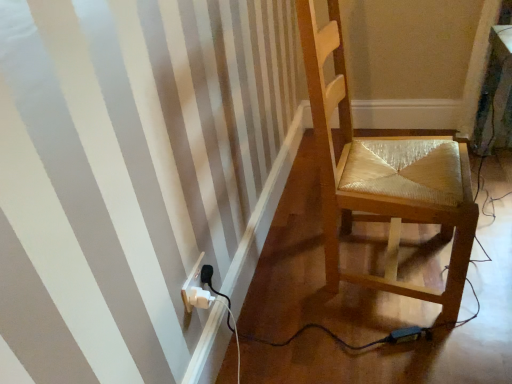
This screenshot has height=384, width=512. What do you see at coordinates (384, 176) in the screenshot?
I see `wooden chair at right` at bounding box center [384, 176].

Where is `wooden chair at right`? This screenshot has width=512, height=384. wooden chair at right is located at coordinates (384, 176).

What do you see at coordinates (195, 290) in the screenshot? I see `white plastic electrical outlet at lower left` at bounding box center [195, 290].

You are a GUI agent. You are given a task and a screenshot of the screen. Output one action in this format:
    pyautogui.click(x=<x>, y=<y>)
    Task: Click on the white plastic electrical outlet at lower left
    
    Given the screenshot: What is the action you would take?
    pyautogui.click(x=195, y=290)

Locate an element on the screen. Image resolution: width=512 pixels, height=384 pixels. wooden chair at right is located at coordinates (384, 176).

Visually, is wooden chair at right positioned to the left or to the right of white plastic electrical outlet at lower left?

Clearly, wooden chair at right is on the right of white plastic electrical outlet at lower left in the image.

Considering the relative positions of wooden chair at right and white plastic electrical outlet at lower left in the image provided, is wooden chair at right behind white plastic electrical outlet at lower left?

No.

Does point (347, 99) lie in front of point (200, 257)?

No.

In the scene shown: From the image's perspective, relative to white plastic electrical outlet at lower left, is wooden chair at right above or below?

Based on their image positions, wooden chair at right is located above white plastic electrical outlet at lower left.

From a real-world perspective, is wooden chair at right on top of white plastic electrical outlet at lower left?

Yes, from a real-world perspective, wooden chair at right is over white plastic electrical outlet at lower left

Can you confirm if wooden chair at right is wider than white plastic electrical outlet at lower left?

Indeed, wooden chair at right has a greater width compared to white plastic electrical outlet at lower left.

Consider the image. Can you confirm if wooden chair at right is shorter than white plastic electrical outlet at lower left?

Incorrect, the height of wooden chair at right does not fall short of that of white plastic electrical outlet at lower left.

Which of these two, wooden chair at right or white plastic electrical outlet at lower left, is bigger?

wooden chair at right.

Is wooden chair at right located outside white plastic electrical outlet at lower left?

Absolutely, wooden chair at right is external to white plastic electrical outlet at lower left.

Would you say wooden chair at right is a long distance from white plastic electrical outlet at lower left?

No, there isn't a large distance between wooden chair at right and white plastic electrical outlet at lower left.

Does wooden chair at right turn towards white plastic electrical outlet at lower left?

No, wooden chair at right does not turn towards white plastic electrical outlet at lower left.

Can you tell me how much wooden chair at right and white plastic electrical outlet at lower left differ in facing direction?

5.21 degrees separate the facing orientations of wooden chair at right and white plastic electrical outlet at lower left.

The width and height of the screenshot is (512, 384). Find the location of `chair that is on the right side of white plastic electrical outlet at lower left`. chair that is on the right side of white plastic electrical outlet at lower left is located at coordinates (384, 176).

Is white plastic electrical outlet at lower left at the right side of wooden chair at right?

No, white plastic electrical outlet at lower left is not to the right of wooden chair at right.

Consider the image. Considering the relative positions of white plastic electrical outlet at lower left and wooden chair at right in the image provided, is white plastic electrical outlet at lower left behind wooden chair at right?

Yes, it is.

Does point (188, 292) come in front of point (326, 249)?

Yes, it is in front of point (326, 249).

From the image's perspective, which object appears higher, white plastic electrical outlet at lower left or wooden chair at right?

wooden chair at right, from the image's perspective.

From a real-world perspective, is white plastic electrical outlet at lower left on top of wooden chair at right?

No, from a real-world perspective, white plastic electrical outlet at lower left is not over wooden chair at right

Which of these two, white plastic electrical outlet at lower left or wooden chair at right, is wider?

wooden chair at right is wider.

Is white plastic electrical outlet at lower left taller or shorter than wooden chair at right?

Considering their sizes, white plastic electrical outlet at lower left has less height than wooden chair at right.

In terms of size, does white plastic electrical outlet at lower left appear bigger or smaller than wooden chair at right?

Considering their sizes, white plastic electrical outlet at lower left takes up less space than wooden chair at right.

Is white plastic electrical outlet at lower left inside the boundaries of wooden chair at right, or outside?

white plastic electrical outlet at lower left is not inside wooden chair at right, it's outside.

Are white plastic electrical outlet at lower left and wooden chair at right far apart?

No, white plastic electrical outlet at lower left is not far from wooden chair at right.

Is white plastic electrical outlet at lower left oriented towards wooden chair at right?

No, white plastic electrical outlet at lower left does not turn towards wooden chair at right.

What's the angular difference between white plastic electrical outlet at lower left and wooden chair at right's facing directions?

The facing directions of white plastic electrical outlet at lower left and wooden chair at right are 5.21 degrees apart.

Measure the distance between white plastic electrical outlet at lower left and wooden chair at right.

white plastic electrical outlet at lower left is 26.04 inches away from wooden chair at right.

Identify the location of chair above the white plastic electrical outlet at lower left (from the image's perspective). (384, 176).

The image size is (512, 384). What are the coordinates of `electric outlet behind the wooden chair at right` in the screenshot? It's located at point(195,290).

Identify the location of chair above the white plastic electrical outlet at lower left (from a real-world perspective). (384, 176).